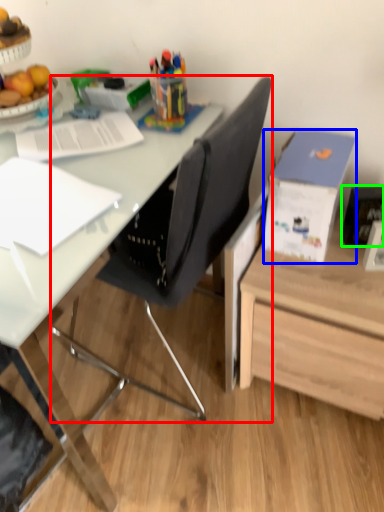
Question: Which object is positioned farthest from chair (highlighted by a red box)? Select from box (highlighted by a blue box) and picture frame (highlighted by a green box).

Choices:
 (A) box
 (B) picture frame

Answer: (B)